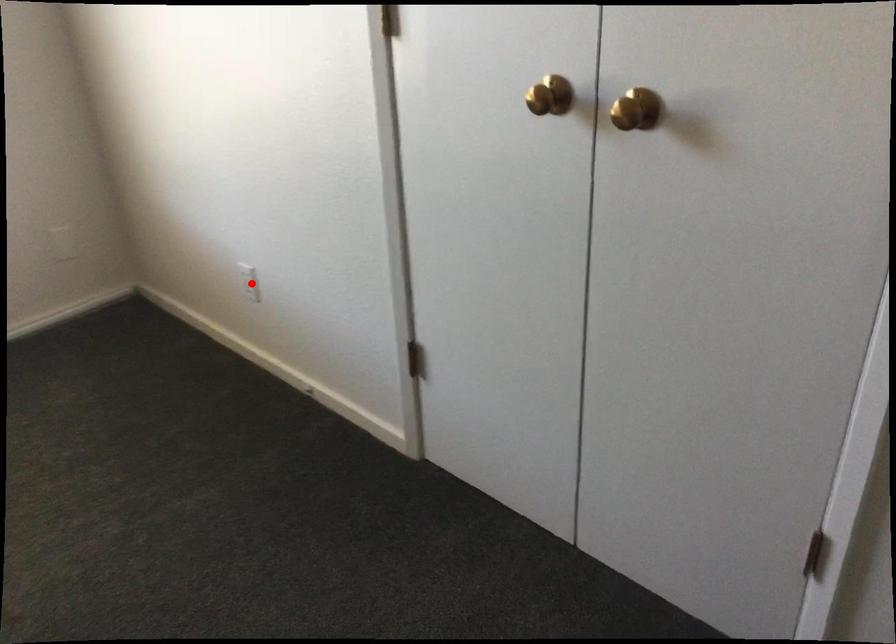
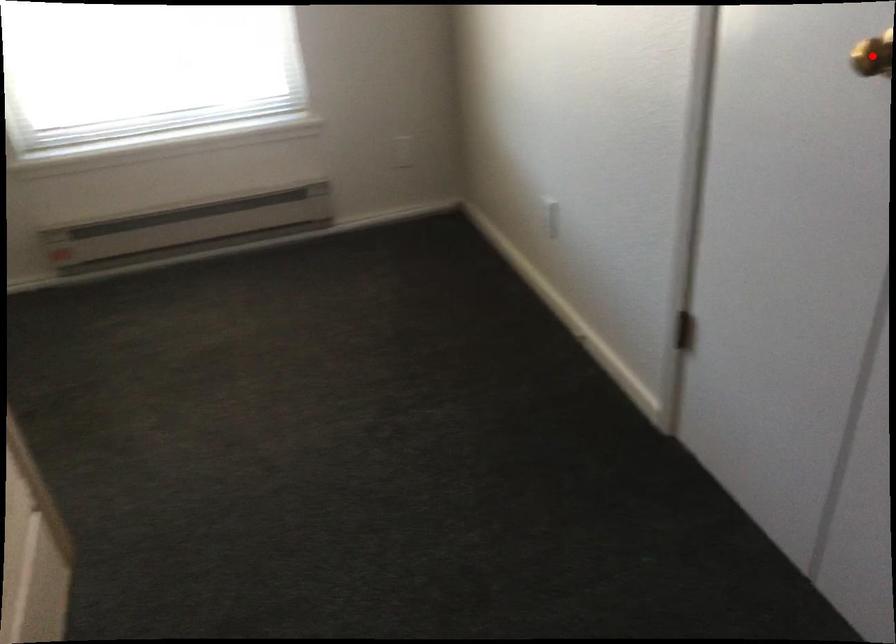
I am providing you with two images of the same scene from different viewpoints. A red point is marked on the first image and another point is marked on the second image. Are the points marked in image1 and image2 representing the same 3D position?

No